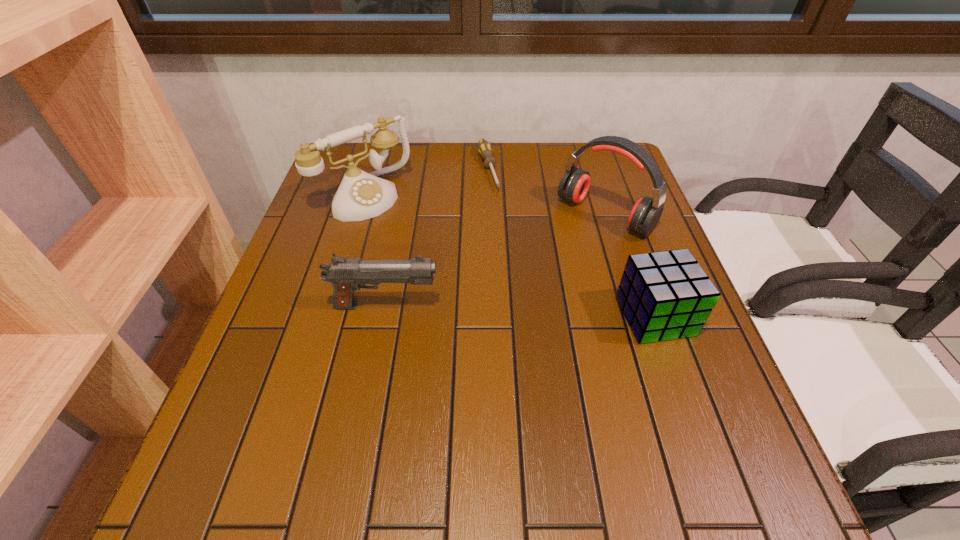
This screenshot has height=540, width=960. Identify the location of gun. (346, 274).

Where is `cube`? The image size is (960, 540). cube is located at coordinates (665, 295).

Locate an element on the screen. The height and width of the screenshot is (540, 960). telephone is located at coordinates (361, 195).

Locate an element on the screen. earphone is located at coordinates (574, 185).

The height and width of the screenshot is (540, 960). What are the coordinates of `the third object from left to right` in the screenshot? It's located at (484, 147).

Identify the location of screwdriver. click(484, 147).

You are a GUI agent. You are given a task and a screenshot of the screen. Output one action in this format:
    pyautogui.click(x=<x>, y=<y>)
    Task: Click on the vacant space situated 0.270m in the direction the gun is aimed
    The height and width of the screenshot is (540, 960).
    Given the screenshot: What is the action you would take?
    pyautogui.click(x=565, y=306)

Find the location of a particular element. Image resolution: width=960 pixels, height=540 pixels. vacant space situated on the left of the cube is located at coordinates (563, 316).

Find the location of a particular element. Image resolution: width=960 pixels, height=540 pixels. vacant point located 0.090m on the dial of the telephone is located at coordinates (407, 233).

At what (x,y) coordinates should I click in order to perform the action: click on vacant area located on the dial of the telephone. Please return your answer as a coordinate pair (x, y). Looking at the image, I should click on (444, 267).